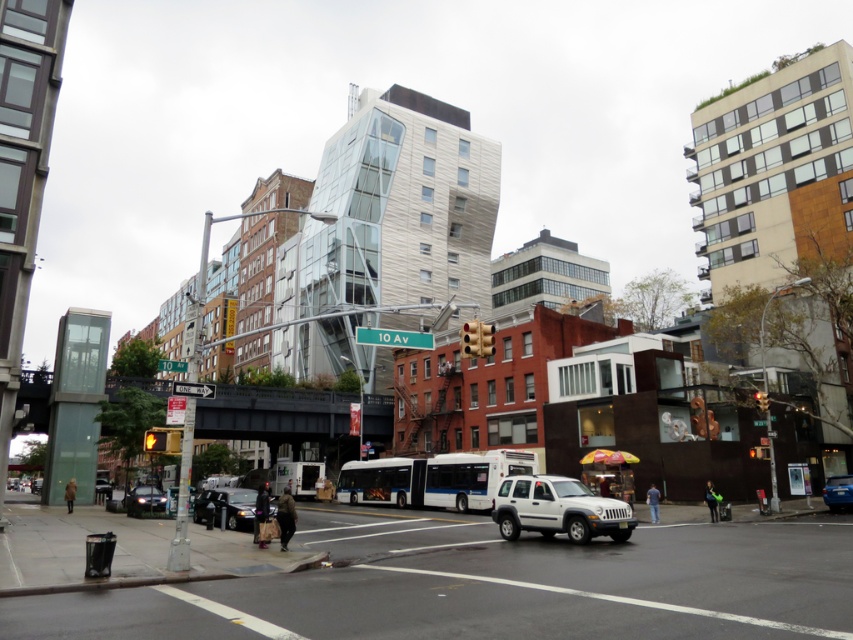
You are a delivery driver needing to park your white matte suv at center in a designated parking spot located at coordinates 0.8, 0.65. Can you safely park there?

The white matte suv at center is positioned at point (558, 509), which is very close to the parking spot at (554, 512). The slight difference in coordinates suggests the vehicle can be maneuvered into the spot with minimal adjustment, so yes, it can be parked there safely.

You are a pedestrian waiting at the intersection. You see the white matte suv at center and the yellow glass traffic light at center. Which object is closer to the left side of the street?

The white matte suv at center is closer to the left side of the street because it is positioned to the left of the yellow glass traffic light at center.